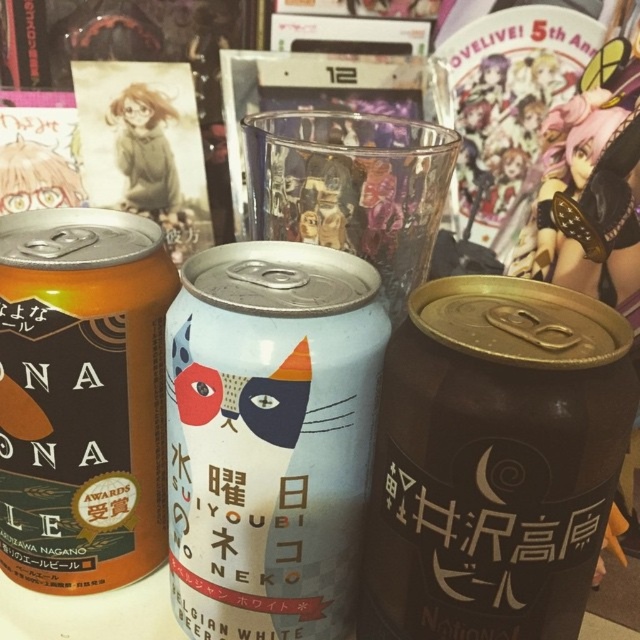
Who is positioned more to the left, matte blue can at center or matte orange can at left?

matte orange can at left

Is matte blue can at center closer to the viewer compared to matte orange can at left?

Yes, it is in front of matte orange can at left.

Does point (193, 529) lie in front of point (160, 368)?

Yes.

Locate an element on the screen. The width and height of the screenshot is (640, 640). matte blue can at center is located at coordinates (269, 436).

Is black matte can at center shorter than matte blue can at center?

Indeed, black matte can at center has a lesser height compared to matte blue can at center.

Between black matte can at center and matte blue can at center, which one is positioned higher?

matte blue can at center is higher up.

Which is in front, point (602, 340) or point (266, 284)?

Point (602, 340) is more forward.

What are the coordinates of `black matte can at center` in the screenshot? It's located at (493, 461).

Between black matte can at center and matte orange can at left, which one has less height?

With less height is black matte can at center.

Does black matte can at center appear on the right side of matte orange can at left?

Indeed, black matte can at center is positioned on the right side of matte orange can at left.

At what (x,y) coordinates should I click in order to perform the action: click on black matte can at center. Please return your answer as a coordinate pair (x, y). Looking at the image, I should click on (493, 461).